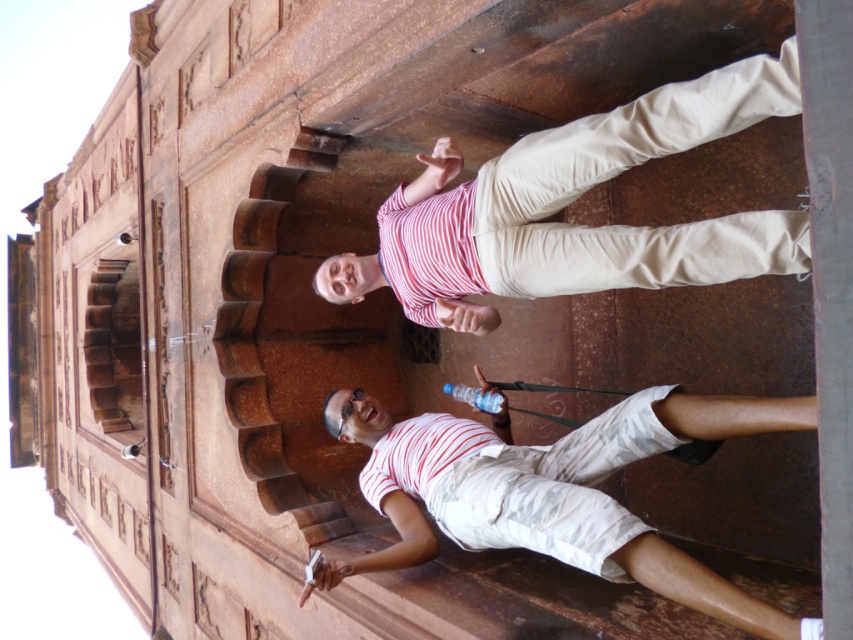
Question: Which of the following is the closest to the observer?

Choices:
 (A) (466, 227)
 (B) (448, 454)

Answer: (A)

Question: Is the position of striped cotton shirt at center less distant than that of white cotton shorts at lower right?

Choices:
 (A) yes
 (B) no

Answer: (B)

Question: Does striped cotton shirt at center appear under white cotton shorts at lower right?

Choices:
 (A) no
 (B) yes

Answer: (A)

Question: Is striped cotton shirt at center positioned at the back of white cotton shorts at lower right?

Choices:
 (A) no
 (B) yes

Answer: (B)